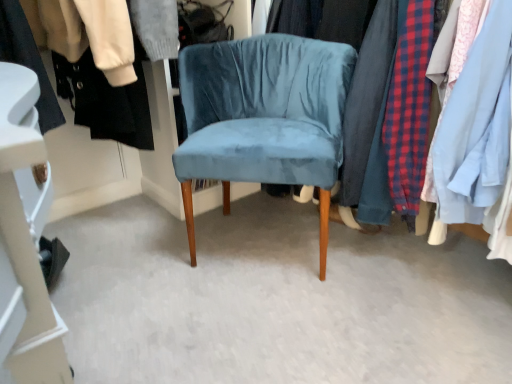
Identify the location of vacant area situated to the left side of velvet blue chair at center. The image size is (512, 384). (135, 248).